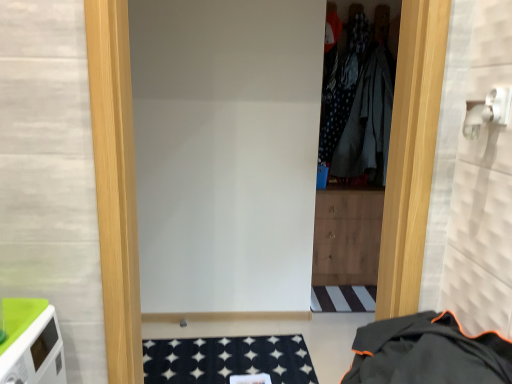
Question: From the image's perspective, is black fabric jacket at lower right, marked as the 2th clothing in a top-to-bottom arrangement, positioned above or below dark grey fabric at center, the 2th clothing from the front?

Choices:
 (A) above
 (B) below

Answer: (B)

Question: Considering the positions of point (432, 375) and point (352, 130), is point (432, 375) closer or farther from the camera than point (352, 130)?

Choices:
 (A) farther
 (B) closer

Answer: (B)

Question: Which object is the farthest from the black fabric jacket at lower right, the 1th clothing viewed from the front?

Choices:
 (A) white matte door at center
 (B) dark grey fabric at center, the 2th clothing from the front

Answer: (B)

Question: Estimate the real-world distances between objects in this image. Which object is farther from the white matte door at center?

Choices:
 (A) dark grey fabric at center, the 1th clothing in the top-to-bottom sequence
 (B) black fabric jacket at lower right, the second clothing when ordered from back to front

Answer: (A)